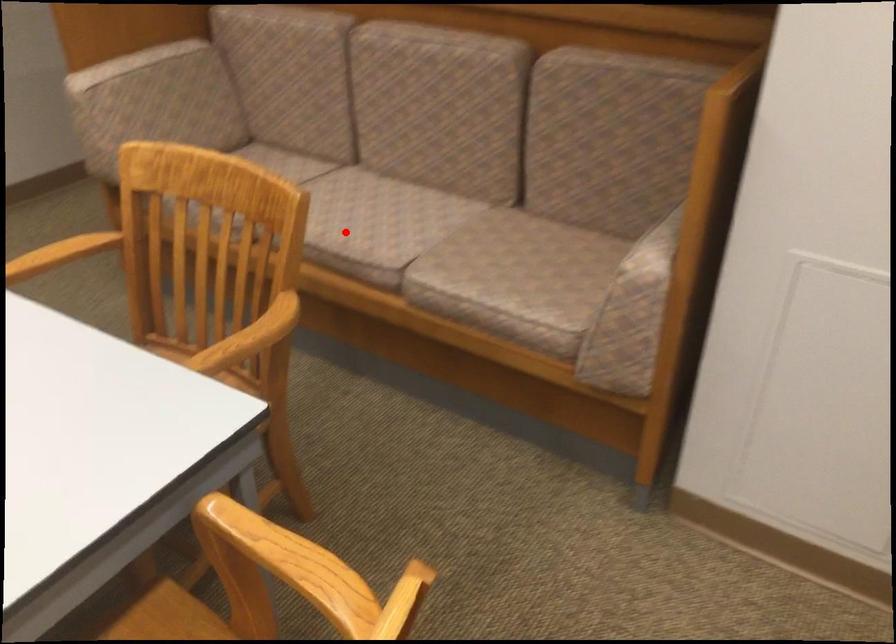
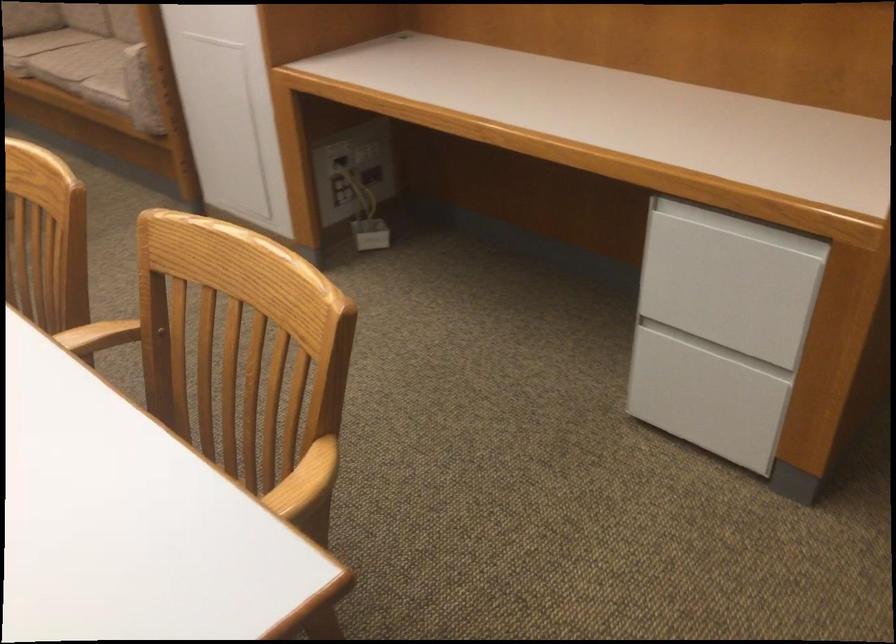
Question: I am providing you with two images of the same scene from different viewpoints. A red point is shown in image1. For the corresponding object point in image2, is it positioned nearer or farther from the camera?

Choices:
 (A) Nearer
 (B) Farther

Answer: (B)